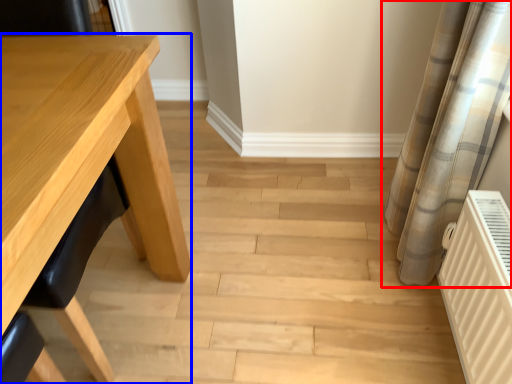
Question: Which point is closer to the camera, curtain (highlighted by a red box) or table (highlighted by a blue box)?

Choices:
 (A) curtain
 (B) table

Answer: (B)